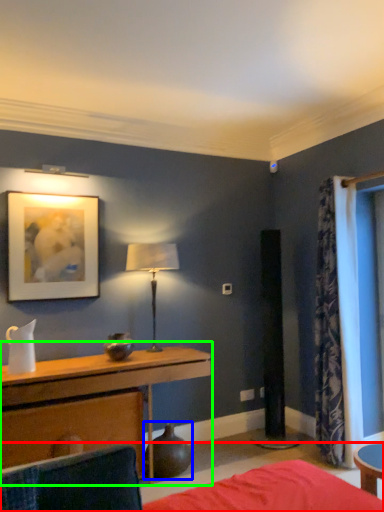
Question: Which is farther away from bed (highlighted by a red box)? vase (highlighted by a blue box) or table (highlighted by a green box)?

Choices:
 (A) vase
 (B) table

Answer: (A)